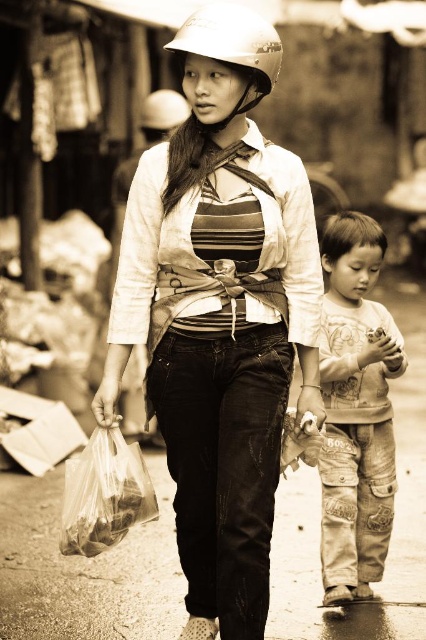
You are a photographer analyzing the image. You need to determine which object is closer to the camera between the translucent plastic bag at lower left and the matte white helmet at upper center. Based on the spatial arrangement, which one is closer?

The translucent plastic bag at lower left is closer to the camera than the matte white helmet at upper center because it is positioned further to the viewer.

You are a photographer analyzing the composition of this vintage photo. The image has a point marked at coordinates (356, 410). Based on the scene description, what object is located at this point?

The point at coordinates (356, 410) indicates the printed cotton shirt at lower right.

You are a photographer analyzing this vintage photo. You notice the printed cotton shirt at lower right and the translucent plastic bag at lower left. Which object is positioned higher in the image?

The printed cotton shirt at lower right is much taller than the translucent plastic bag at lower left, so the printed cotton shirt at lower right is positioned higher in the image.